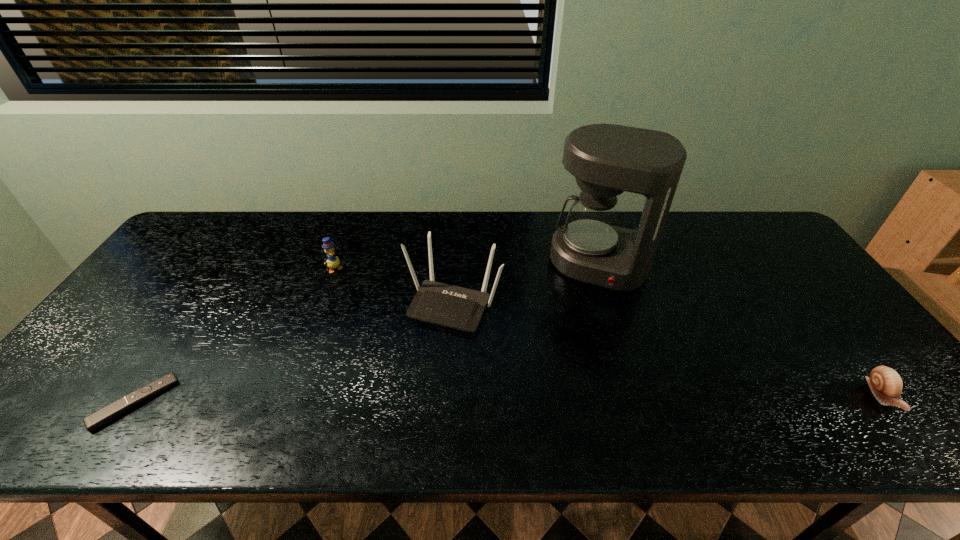
Locate an element on the screen. This screenshot has width=960, height=540. free spot located 0.190m on the back of the shortest object is located at coordinates (191, 316).

Find the location of a particular element. The height and width of the screenshot is (540, 960). vacant space located 0.130m on the face of the duckling, where the monocle is placed is located at coordinates pos(359,297).

In order to click on free point located 0.060m on the face of the duckling, where the monocle is placed in this screenshot , I will do `click(348, 284)`.

Find the location of a particular element. vacant space located 0.100m on the face of the duckling, where the monocle is placed is located at coordinates (354, 292).

Locate an element on the screen. The width and height of the screenshot is (960, 540). vacant space situated 0.070m on the button side of the second object from right to left is located at coordinates (583, 308).

You are a GUI agent. You are given a task and a screenshot of the screen. Output one action in this format:
    pyautogui.click(x=<x>, y=<y>)
    Task: Click on the vacant area situated on the button side of the second object from right to left
    The width and height of the screenshot is (960, 540).
    Given the screenshot: What is the action you would take?
    pyautogui.click(x=580, y=318)

This screenshot has height=540, width=960. What are the coordinates of `vacant region located 0.130m on the button side of the second object from right to left` in the screenshot? It's located at (578, 323).

Where is `free space located 0.130m on the front-facing side of the router`? Image resolution: width=960 pixels, height=540 pixels. free space located 0.130m on the front-facing side of the router is located at coordinates (416, 374).

Where is `free spot located on the front-facing side of the router`? free spot located on the front-facing side of the router is located at coordinates (429, 349).

Find the location of a particular element. free location located 0.050m on the front-facing side of the router is located at coordinates (429, 349).